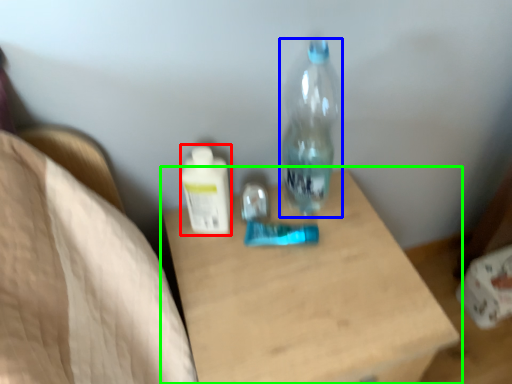
Question: Which object is positioned farthest from bottle (highlighted by a red box)? Select from bottle (highlighted by a blue box) and table (highlighted by a green box).

Choices:
 (A) bottle
 (B) table

Answer: (B)